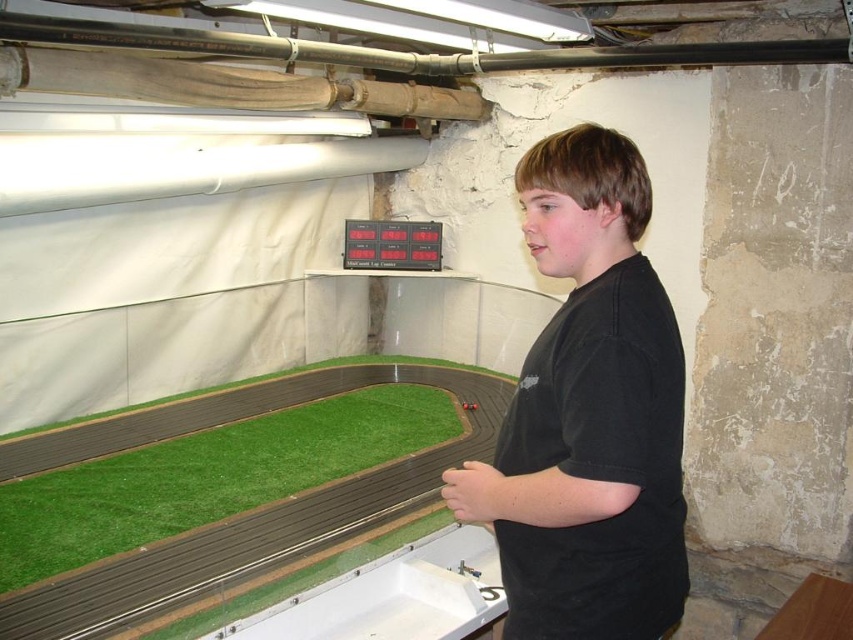
Consider the image. Between black matte shirt at center and green artificial turf at lower left, which one has less height?

green artificial turf at lower left

Can you confirm if black matte shirt at center is positioned below green artificial turf at lower left?

No.

The width and height of the screenshot is (853, 640). What do you see at coordinates (589, 413) in the screenshot? I see `black matte shirt at center` at bounding box center [589, 413].

This screenshot has width=853, height=640. I want to click on black matte shirt at center, so click(589, 413).